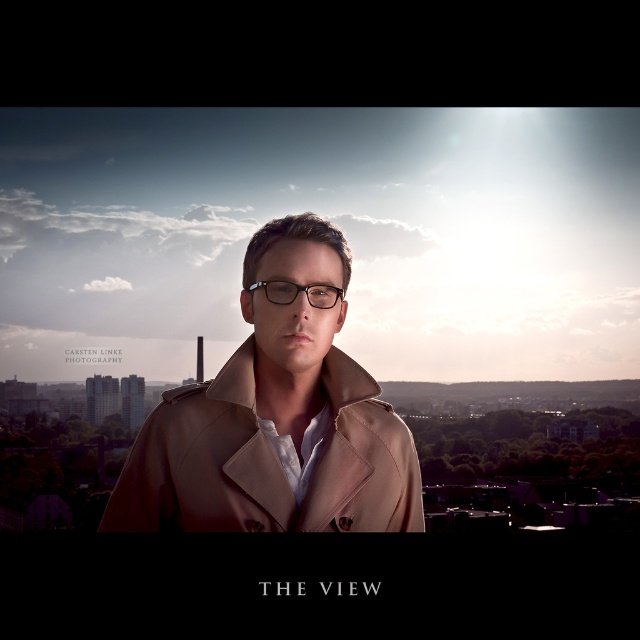
You are a photographer trying to capture the tan leather trench coat at center in your shot. Given that your camera has a focal length of 50mm and you are positioned at point 0,0, can you estimate the angle needed to frame the coat properly?

The tan leather trench coat at center is located at coordinates (x=268, y=461). Using the camera at position (x=0, y=0) with a 50mm lens, the angle required to frame the coat would be calculated based on its position relative to the camera. However, without additional distance information, an exact angle cannot be determined. Adjust your framing to center on the coordinates provided.

You are a fashion designer analyzing the image. You need to determine if the tan leather trench coat at center can be worn with the matte black glasses at center without any adjustments. Based on their sizes, is this feasible?

The tan leather trench coat at center is wider than the matte black glasses at center, so yes, the coat can be worn with the glasses without any adjustments since the glasses are smaller in width and won

You are a fashion photographer analyzing the composition of this image. You need to determine the placement of the tan leather trench coat at center and matte black glasses at center relative to each other. Which object is positioned to the right?

The matte black glasses at center is positioned to the right of the tan leather trench coat at center.